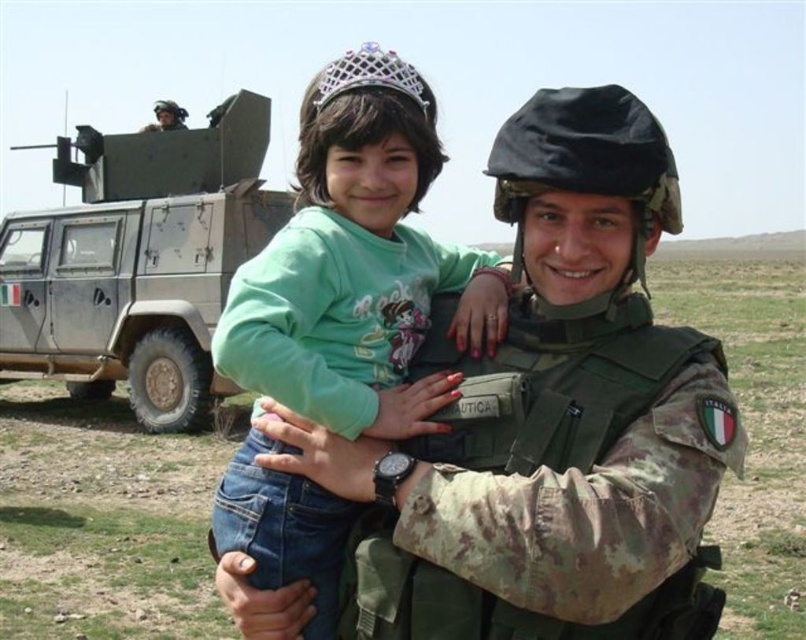
Question: Estimate the real-world distances between objects in this image. Which object is closer to the camouflage military vehicle at upper left?

Choices:
 (A) matte black helmet at upper left
 (B) green matte shirt at center

Answer: (A)

Question: Can you confirm if green matte shirt at center is thinner than camouflage military vehicle at upper left?

Choices:
 (A) no
 (B) yes

Answer: (A)

Question: Which object is farther from the camera taking this photo?

Choices:
 (A) camouflage military vehicle at upper left
 (B) green matte shirt at center
 (C) matte black helmet at upper left

Answer: (C)

Question: Which of the following is the farthest from the observer?

Choices:
 (A) click(x=181, y=118)
 (B) click(x=142, y=173)

Answer: (A)

Question: Can you confirm if green matte shirt at center is bigger than camouflage military vehicle at upper left?

Choices:
 (A) yes
 (B) no

Answer: (A)

Question: Is camouflage military vehicle at upper left below matte black helmet at upper left?

Choices:
 (A) no
 (B) yes

Answer: (B)